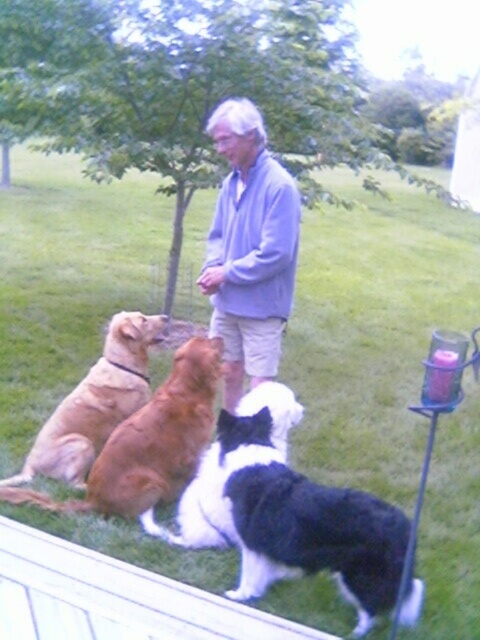
You are a photographer trying to capture a group photo of the person and the dogs. You need to ensure that both the light blue sweater at center and the golden brown fur at center are clearly visible in the frame. Based on their heights, which one should you focus on first to ensure proper focus?

The light blue sweater at center is taller than golden brown fur at center, so you should focus on the light blue sweater at center first to ensure proper focus.

You are a photographer trying to capture a group photo of the black and white fur at center and golden brown fur at center. Since you want to ensure both dogs are clearly visible, which dog should you adjust the camera focus to prioritize based on their sizes?

The black and white fur at center is wider than the golden brown fur at center, so you should prioritize focusing on the black and white fur at center to ensure its details are captured clearly.